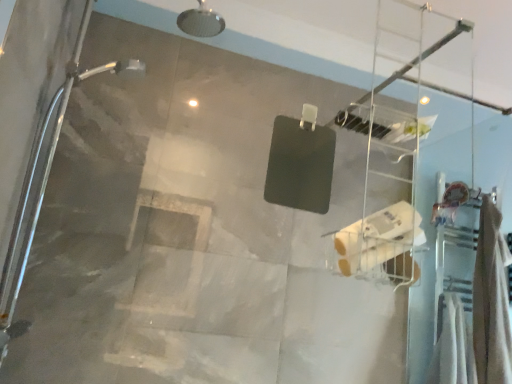
Question: Is white matte toilet paper at center thinner than beige fabric towel at right?

Choices:
 (A) no
 (B) yes

Answer: (B)

Question: Is beige fabric towel at right inside white matte toilet paper at center?

Choices:
 (A) yes
 (B) no

Answer: (B)

Question: From a real-world perspective, does white matte toilet paper at center sit lower than beige fabric towel at right?

Choices:
 (A) yes
 (B) no

Answer: (A)

Question: Would you say white matte toilet paper at center is outside beige fabric towel at right?

Choices:
 (A) yes
 (B) no

Answer: (A)

Question: Does white matte toilet paper at center lie in front of beige fabric towel at right?

Choices:
 (A) yes
 (B) no

Answer: (A)

Question: From the image's perspective, is clear plastic ladder at upper center located above or below white matte toilet paper at center?

Choices:
 (A) above
 (B) below

Answer: (A)

Question: Considering the relative positions of clear plastic ladder at upper center and white matte toilet paper at center in the image provided, is clear plastic ladder at upper center to the left or to the right of white matte toilet paper at center?

Choices:
 (A) right
 (B) left

Answer: (A)

Question: From their relative heights in the image, would you say clear plastic ladder at upper center is taller or shorter than white matte toilet paper at center?

Choices:
 (A) tall
 (B) short

Answer: (A)

Question: Is clear plastic ladder at upper center in front of or behind white matte toilet paper at center in the image?

Choices:
 (A) behind
 (B) front

Answer: (A)

Question: From the image's perspective, is beige fabric towel at right located above or below clear plastic ladder at upper center?

Choices:
 (A) below
 (B) above

Answer: (A)

Question: Is beige fabric towel at right to the left or to the right of clear plastic ladder at upper center in the image?

Choices:
 (A) left
 (B) right

Answer: (B)

Question: Considering their positions, is beige fabric towel at right located in front of or behind clear plastic ladder at upper center?

Choices:
 (A) front
 (B) behind

Answer: (B)

Question: Does point (508, 256) appear closer or farther from the camera than point (358, 122)?

Choices:
 (A) closer
 (B) farther

Answer: (B)

Question: From a real-world perspective, is white matte toilet paper at center physically located above or below clear plastic ladder at upper center?

Choices:
 (A) below
 (B) above

Answer: (A)

Question: Is white matte toilet paper at center taller or shorter than clear plastic ladder at upper center?

Choices:
 (A) short
 (B) tall

Answer: (A)